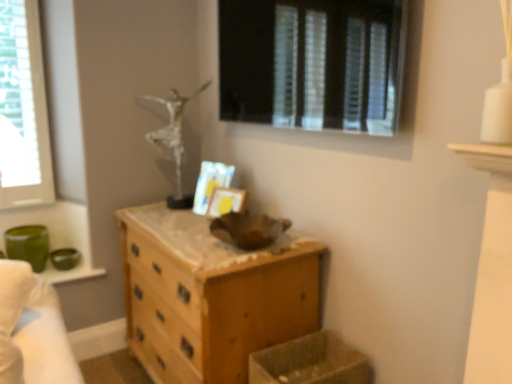
Question: From a real-world perspective, is wooden chest of drawers at center on top of clear glass window at left, which appears as the second window when viewed from the right?

Choices:
 (A) yes
 (B) no

Answer: (B)

Question: Is clear glass window at left, which appears as the second window when viewed from the right, inside wooden chest of drawers at center?

Choices:
 (A) no
 (B) yes

Answer: (A)

Question: Are wooden chest of drawers at center and clear glass window at left, positioned as the 1th window in back-to-front order, beside each other?

Choices:
 (A) yes
 (B) no

Answer: (B)

Question: From the image's perspective, would you say wooden chest of drawers at center is shown under clear glass window at left, which appears as the 2th window when viewed from the front?

Choices:
 (A) no
 (B) yes

Answer: (B)

Question: Is the position of wooden chest of drawers at center more distant than that of clear glass window at left, the first window when ordered from left to right?

Choices:
 (A) no
 (B) yes

Answer: (A)

Question: Does wooden chest of drawers at center appear on the left side of clear glass window at left, which appears as the second window when viewed from the right?

Choices:
 (A) no
 (B) yes

Answer: (A)

Question: Is clear glass window at left, the first window when ordered from left to right, surrounding translucent plastic crate at lower center?

Choices:
 (A) no
 (B) yes

Answer: (A)

Question: From a real-world perspective, is clear glass window at left, which appears as the second window when viewed from the right, on top of translucent plastic crate at lower center?

Choices:
 (A) no
 (B) yes

Answer: (B)

Question: Is clear glass window at left, positioned as the 1th window in back-to-front order, to the right of translucent plastic crate at lower center from the viewer's perspective?

Choices:
 (A) no
 (B) yes

Answer: (A)

Question: Can you confirm if clear glass window at left, the first window when ordered from left to right, is thinner than translucent plastic crate at lower center?

Choices:
 (A) yes
 (B) no

Answer: (A)

Question: Is clear glass window at left, which appears as the 2th window when viewed from the front, oriented towards translucent plastic crate at lower center?

Choices:
 (A) yes
 (B) no

Answer: (B)

Question: Is clear glass window at left, which appears as the 2th window when viewed from the front, not close to translucent plastic crate at lower center?

Choices:
 (A) no
 (B) yes

Answer: (B)

Question: Is transparent glass window at upper center, the second window in the back-to-front sequence, surrounded by clear glass window at left, which appears as the second window when viewed from the right?

Choices:
 (A) yes
 (B) no

Answer: (B)